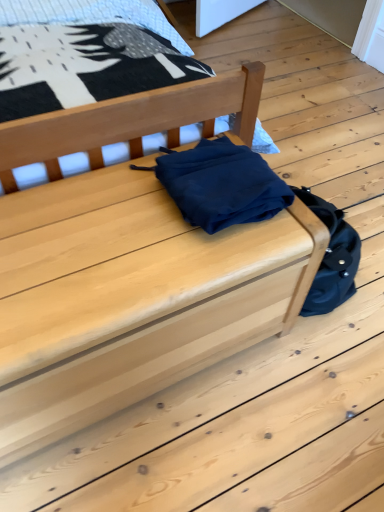
Question: From their relative heights in the image, would you say matte wood chest at center, the 2th furniture from the top, is taller or shorter than matte wood chest at center, placed as the second furniture when sorted from bottom to top?

Choices:
 (A) short
 (B) tall

Answer: (A)

Question: Do you think matte wood chest at center, the 2th furniture from the top, is within matte wood chest at center, which is counted as the first furniture, starting from the top, or outside of it?

Choices:
 (A) inside
 (B) outside

Answer: (B)

Question: Considering the positions of point (183, 241) and point (130, 154), is point (183, 241) closer or farther from the camera than point (130, 154)?

Choices:
 (A) closer
 (B) farther

Answer: (A)

Question: Is matte wood chest at center, which is counted as the first furniture, starting from the top, taller or shorter than matte wood chest at center, arranged as the 1th furniture when ordered from the bottom?

Choices:
 (A) tall
 (B) short

Answer: (A)

Question: From the image's perspective, relative to matte wood chest at center, arranged as the 1th furniture when ordered from the bottom, is matte wood chest at center, which is counted as the first furniture, starting from the top, above or below?

Choices:
 (A) below
 (B) above

Answer: (B)

Question: Is point (3, 174) closer or farther from the camera than point (87, 412)?

Choices:
 (A) farther
 (B) closer

Answer: (B)

Question: Is matte wood chest at center, which is counted as the first furniture, starting from the top, inside the boundaries of matte wood chest at center, the 2th furniture from the top, or outside?

Choices:
 (A) inside
 (B) outside

Answer: (B)